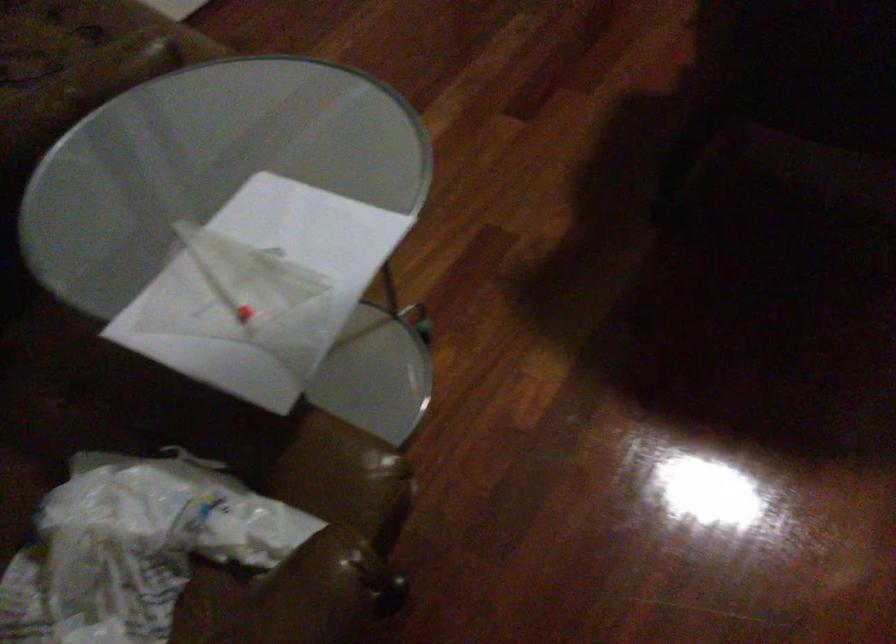
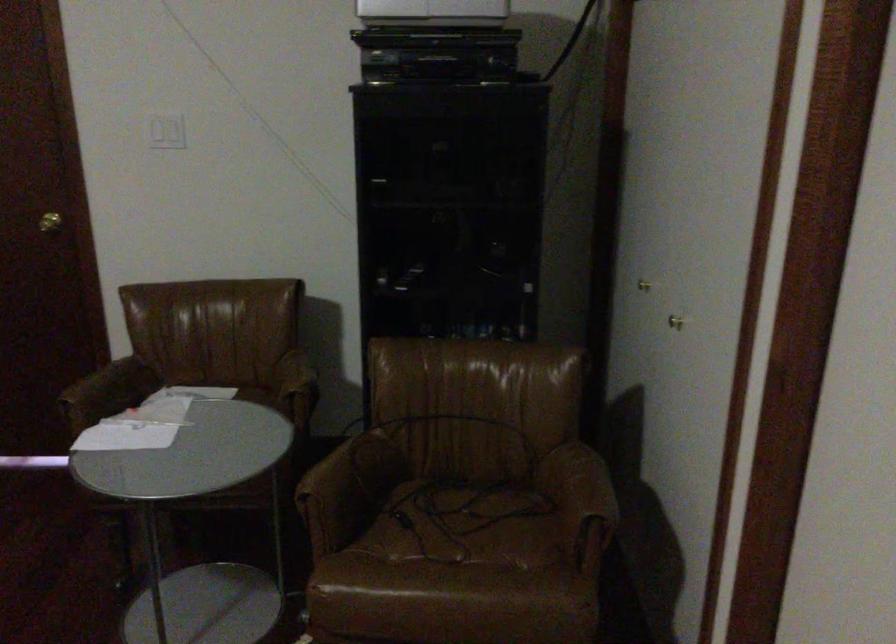
Where in the second image is the point corresponding to point (174, 69) from the first image?

(312, 513)